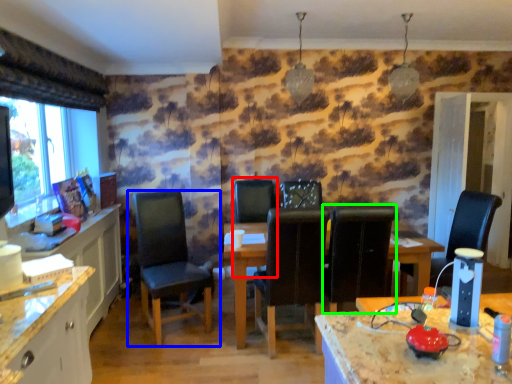
Question: Estimate the real-world distances between objects in this image. Which object is closer to armchair (highlighted by a red box), chair (highlighted by a blue box) or chair (highlighted by a green box)?

Choices:
 (A) chair
 (B) chair

Answer: (A)